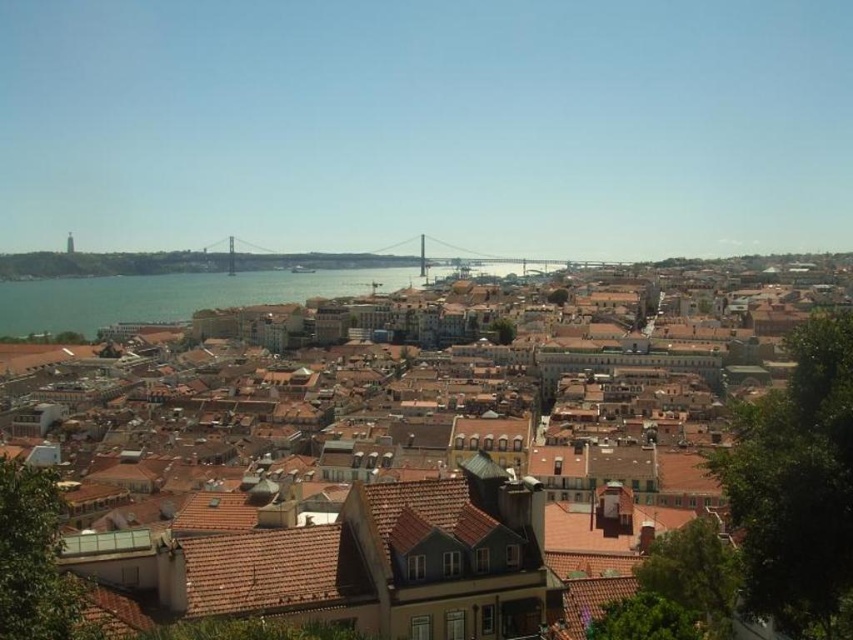
Who is more distant from viewer, [831,477] or [489,262]?

Positioned behind is point [489,262].

Measure the distance between brown tiled roofs at center and camera.

brown tiled roofs at center and camera are 58.07 meters apart from each other.

The image size is (853, 640). What are the coordinates of `brown tiled roofs at center` in the screenshot? It's located at (403, 541).